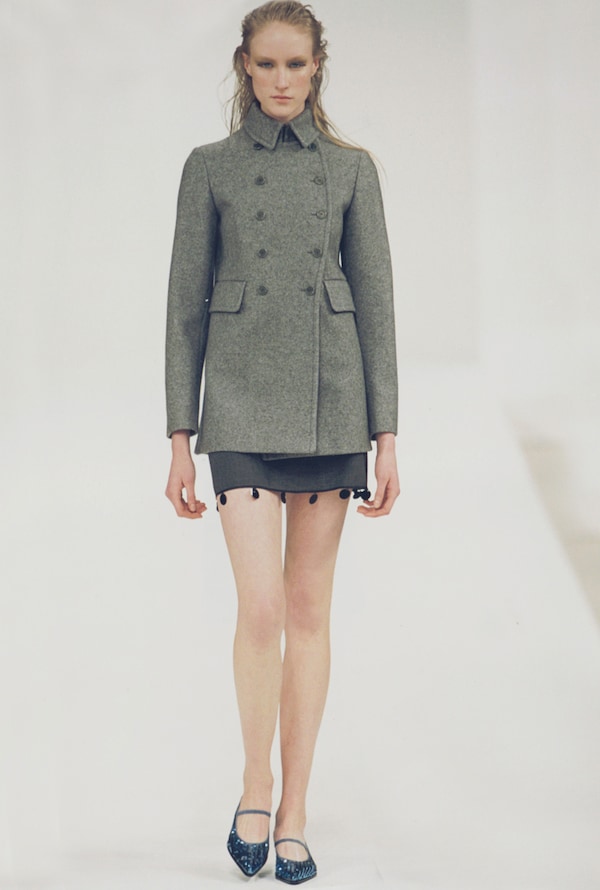
Locate an element on the screen. This screenshot has height=890, width=600. coat is located at coordinates (280, 159).